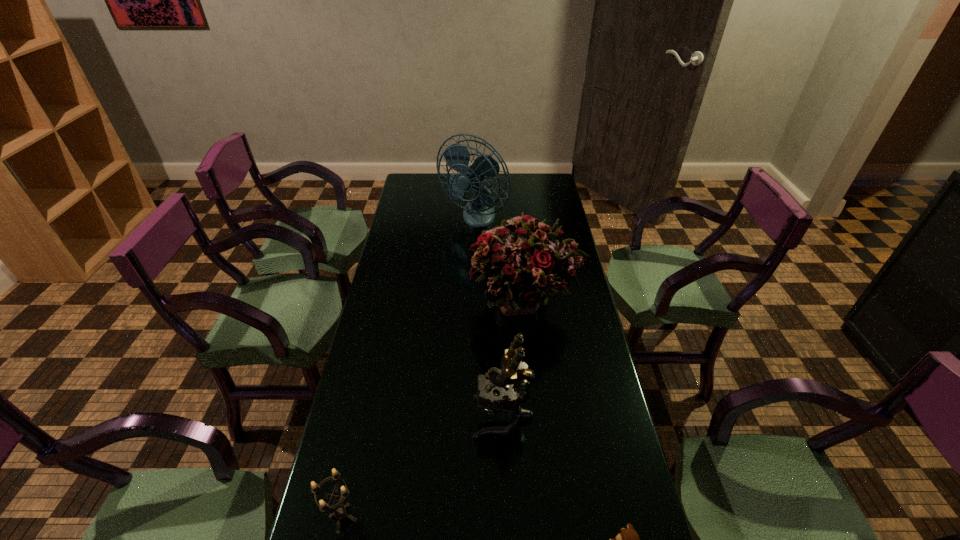
Where is `unoccupied area between the fan and the third farthest object`? unoccupied area between the fan and the third farthest object is located at coordinates (488, 318).

This screenshot has height=540, width=960. Find the location of `vacant region between the fourth tallest object and the farthest object`. vacant region between the fourth tallest object and the farthest object is located at coordinates (408, 368).

Identify which object is the second closest to the farthest object. Please provide its 2D coordinates. Your answer should be formatted as a tuple, i.e. [(x, y)], where the tuple contains the x and y coordinates of a point satisfying the conditions above.

[(495, 391)]

Identify the location of the second closest object to the bouquet. (479, 212).

Find the location of `vacant area that satisfies the following two spatial constraints: 1. at the eyepieces of the third farthest object; 2. on the front side of the second shortest object`. vacant area that satisfies the following two spatial constraints: 1. at the eyepieces of the third farthest object; 2. on the front side of the second shortest object is located at coordinates (507, 518).

You are a GUI agent. You are given a task and a screenshot of the screen. Output one action in this format:
    pyautogui.click(x=<x>, y=<y>)
    Task: Click on the vacant point that satisfies the following two spatial constraints: 1. in front of the fan to blow air; 2. on the left side of the fourth nearest object
    This screenshot has height=540, width=960.
    Given the screenshot: What is the action you would take?
    pyautogui.click(x=471, y=303)